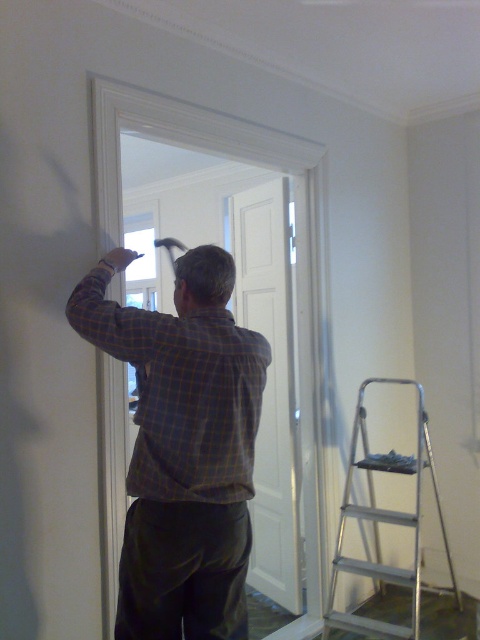
You are planning to move a large potted plant into the room. The potted plant is taller than the plaid shirt at center. Can the silver metallic step ladder at lower right be used to safely place the plant on a high shelf?

The plaid shirt at center has a smaller size compared to the silver metallic step ladder at lower right. Since the potted plant is taller than the plaid shirt at center, but the step ladder is larger, it can likely accommodate the plant safely when placing it on a high shelf.

You are a home inspector assessing the safety of the workspace in the image. The safety guidelines state that the minimum safe distance between a worker and a ladder should be at least 1.5 meters to prevent accidental contact. Based on the scene, is the current distance between the plaid shirt at center and the silver metallic step ladder at lower right compliant with the safety guidelines?

The distance between the plaid shirt at center and the silver metallic step ladder at lower right is 1.27 meters, which is less than the required 1.5 meters. Therefore, the current setup does not comply with the safety guidelines.

Based on the photo, you are a home improvement expert looking at the image. The point at coordinates (x=182, y=445) is part of an object in the scene. Which object is the point located on?

The point at coordinates (x=182, y=445) is located on the plaid shirt at center.